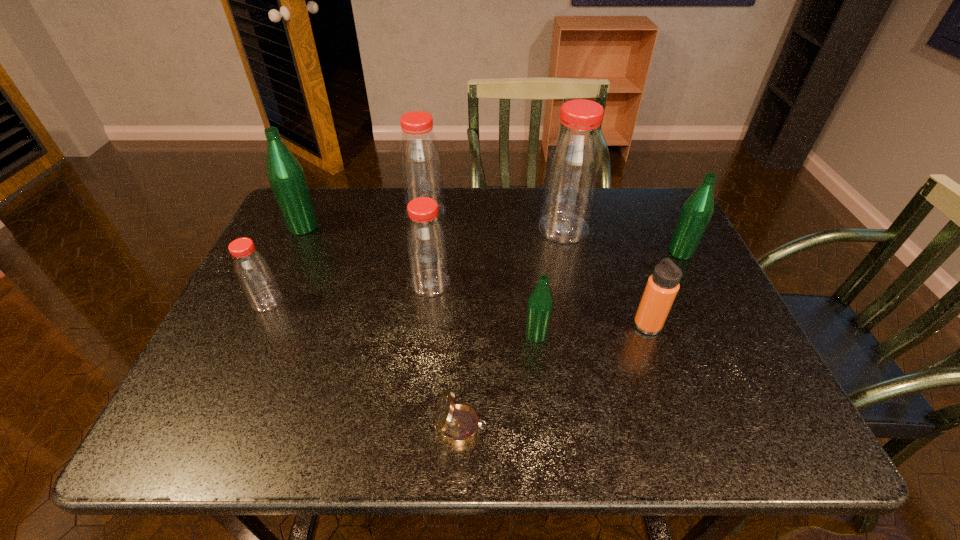
Identify the location of unoccupied position between the compass and the second smallest red bottle. The image size is (960, 540). (445, 355).

Identify the location of blank region between the third biggest red bottle and the leftmost red bottle. The width and height of the screenshot is (960, 540). (348, 292).

Find the location of a particular element. object that is the eighth closest to the eighth object from left to right is located at coordinates (286, 176).

Identify which object is the eighth nearest to the biggest green bottle. Please provide its 2D coordinates. Your answer should be formatted as a tuple, i.e. [(x, y)], where the tuple contains the x and y coordinates of a point satisfying the conditions above.

[(697, 210)]

Select which bottle is the fourth closest to the leftmost red bottle. Please provide its 2D coordinates. Your answer should be formatted as a tuple, i.e. [(x, y)], where the tuple contains the x and y coordinates of a point satisfying the conditions above.

[(540, 303)]

Identify which bottle is the third closest to the third object from right to left. Please provide its 2D coordinates. Your answer should be formatted as a tuple, i.e. [(x, y)], where the tuple contains the x and y coordinates of a point satisfying the conditions above.

[(420, 160)]

The width and height of the screenshot is (960, 540). What are the coordinates of `red bottle that can be found as the closest to the second object from right to left` in the screenshot? It's located at pos(573,166).

Locate which red bottle ranks fourth in proximity to the second green bottle from left to right. Please provide its 2D coordinates. Your answer should be formatted as a tuple, i.e. [(x, y)], where the tuple contains the x and y coordinates of a point satisfying the conditions above.

[(253, 272)]

Select which green bottle appears as the third closest to the orange thermos bottle. Please provide its 2D coordinates. Your answer should be formatted as a tuple, i.e. [(x, y)], where the tuple contains the x and y coordinates of a point satisfying the conditions above.

[(286, 176)]

You are a GUI agent. You are given a task and a screenshot of the screen. Output one action in this format:
    pyautogui.click(x=<x>, y=<y>)
    Task: Click on the green bottle identified as the closest to the biggest red bottle
    This screenshot has width=960, height=540.
    Given the screenshot: What is the action you would take?
    pyautogui.click(x=697, y=210)